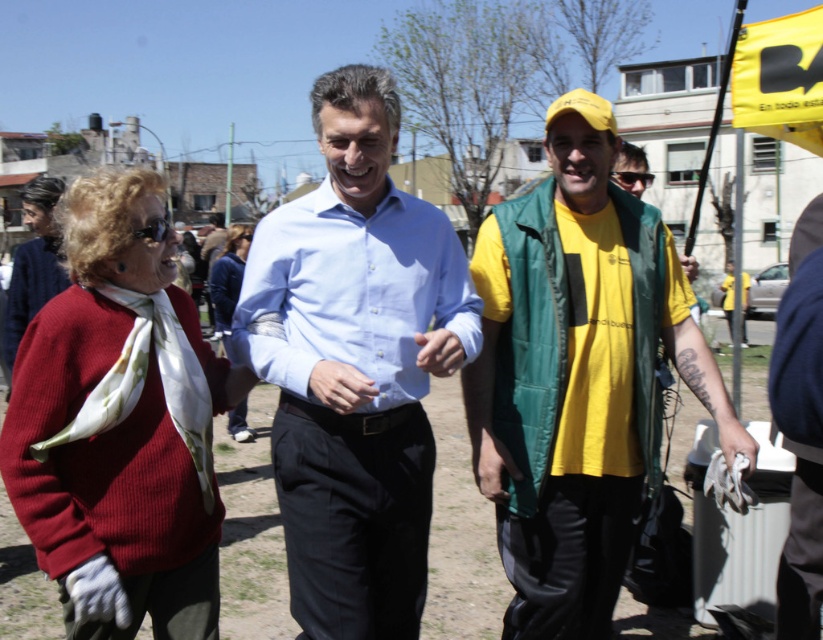
Question: Is light blue shirt at center to the right of yellow fabric flag at upper right from the viewer's perspective?

Choices:
 (A) yes
 (B) no

Answer: (B)

Question: Based on their relative distances, which object is nearer to the light blue shirt at center?

Choices:
 (A) yellow fabric flag at upper right
 (B) matte white scarf at center
 (C) matte red sweater at left

Answer: (C)

Question: Can you confirm if yellow fabric flag at upper right is bigger than matte white scarf at center?

Choices:
 (A) no
 (B) yes

Answer: (A)

Question: Does yellow matte t-shirt at center come behind matte white scarf at center?

Choices:
 (A) yes
 (B) no

Answer: (A)

Question: Estimate the real-world distances between objects in this image. Which object is farther from the matte red sweater at left?

Choices:
 (A) yellow matte t-shirt at center
 (B) yellow fabric flag at upper right
 (C) matte white scarf at center
 (D) light blue shirt at center

Answer: (B)

Question: Among these points, which one is farthest from the camera?

Choices:
 (A) (216, 308)
 (B) (421, 573)

Answer: (A)